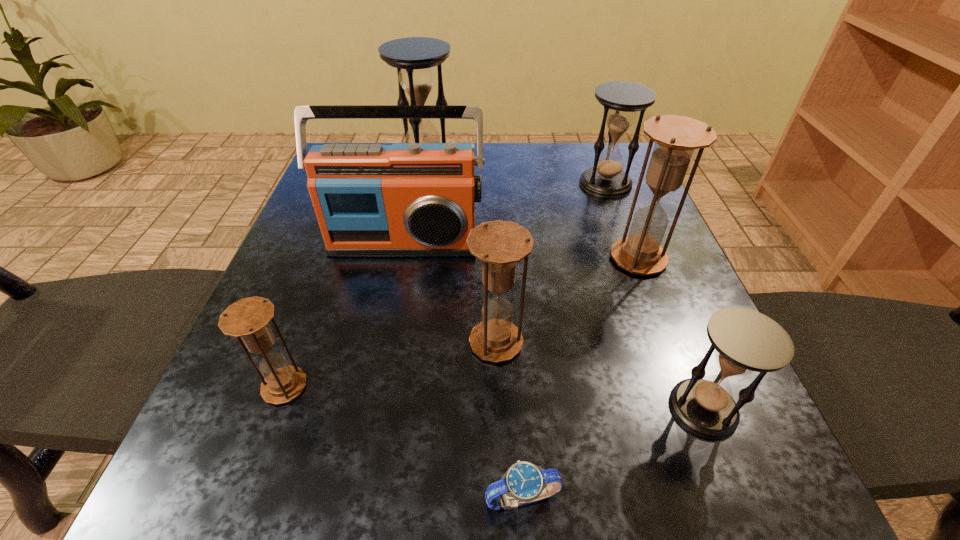
Select which hourglass is the closest to the second smallest black hourglass. Please provide its 2D coordinates. Your answer should be formatted as a tuple, i.e. [(x, y)], where the tuple contains the x and y coordinates of a point satisfying the conditions above.

[(676, 137)]

Where is `black hourglass that is the third closest to the second nearest brown hourglass`? black hourglass that is the third closest to the second nearest brown hourglass is located at coordinates (414, 57).

What are the coordinates of `black hourglass identified as the closest to the blue radio receiver` in the screenshot? It's located at (414, 57).

The height and width of the screenshot is (540, 960). Find the location of `brown hourglass that can be found as the second closest to the fourth nearest hourglass`. brown hourglass that can be found as the second closest to the fourth nearest hourglass is located at coordinates (248, 318).

The image size is (960, 540). Identify the location of brown hourglass that is the third closest to the smallest black hourglass. (248, 318).

The width and height of the screenshot is (960, 540). I want to click on vacant position in the image that satisfies the following two spatial constraints: 1. on the front-facing side of the blue radio receiver; 2. on the right side of the blue watch, so click(x=354, y=498).